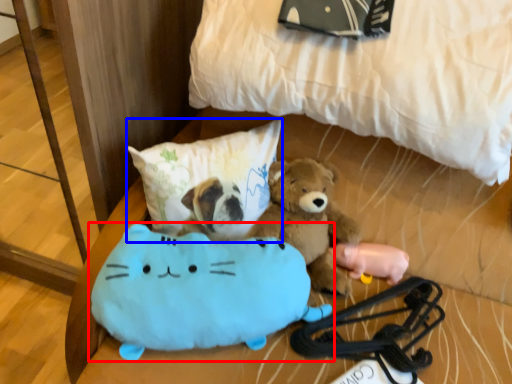
Question: Which object appears closest to the camera in this image, toy (highlighted by a red box) or pillow (highlighted by a blue box)?

Choices:
 (A) toy
 (B) pillow

Answer: (A)